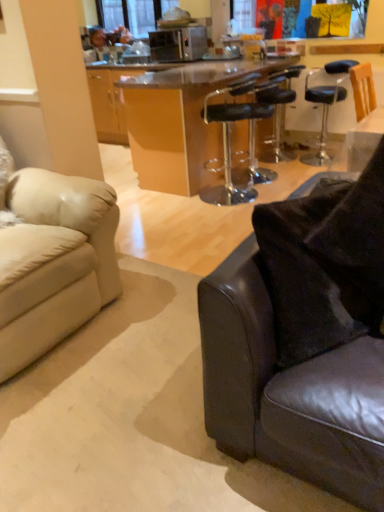
Question: Does transparent plastic bar stool at center, the second chair in the right-to-left sequence, have a greater height compared to satin silver microwave oven at upper center?

Choices:
 (A) no
 (B) yes

Answer: (B)

Question: Considering the relative positions of transparent plastic bar stool at center, the 2th chair positioned from the back, and satin silver microwave oven at upper center in the image provided, is transparent plastic bar stool at center, the 2th chair positioned from the back, to the right of satin silver microwave oven at upper center from the viewer's perspective?

Choices:
 (A) yes
 (B) no

Answer: (A)

Question: Does transparent plastic bar stool at center, the second chair in the right-to-left sequence, appear on the left side of satin silver microwave oven at upper center?

Choices:
 (A) yes
 (B) no

Answer: (B)

Question: From a real-world perspective, does transparent plastic bar stool at center, the first chair when ordered from left to right, sit lower than satin silver microwave oven at upper center?

Choices:
 (A) yes
 (B) no

Answer: (A)

Question: Would you consider transparent plastic bar stool at center, the second chair in the right-to-left sequence, to be distant from satin silver microwave oven at upper center?

Choices:
 (A) yes
 (B) no

Answer: (A)

Question: From the image's perspective, would you say transparent plastic bar stool at center, the first chair when ordered from left to right, is shown under satin silver microwave oven at upper center?

Choices:
 (A) no
 (B) yes

Answer: (B)

Question: Is transparent acrylic table at center positioned far away from clear glass window screen at upper center?

Choices:
 (A) no
 (B) yes

Answer: (B)

Question: From the image's perspective, is transparent acrylic table at center above clear glass window screen at upper center?

Choices:
 (A) no
 (B) yes

Answer: (A)

Question: Does transparent acrylic table at center lie behind clear glass window screen at upper center?

Choices:
 (A) no
 (B) yes

Answer: (A)

Question: Is clear glass window screen at upper center surrounded by transparent acrylic table at center?

Choices:
 (A) no
 (B) yes

Answer: (A)

Question: Can you confirm if transparent acrylic table at center is smaller than clear glass window screen at upper center?

Choices:
 (A) no
 (B) yes

Answer: (A)

Question: From a real-world perspective, does transparent acrylic table at center sit lower than clear glass window screen at upper center?

Choices:
 (A) no
 (B) yes

Answer: (B)

Question: From the image's perspective, would you say transparent plastic bar stool at center, the first chair when ordered from left to right, is positioned over leather couch at lower right, acting as the first studio couch starting from the right?

Choices:
 (A) no
 (B) yes

Answer: (B)